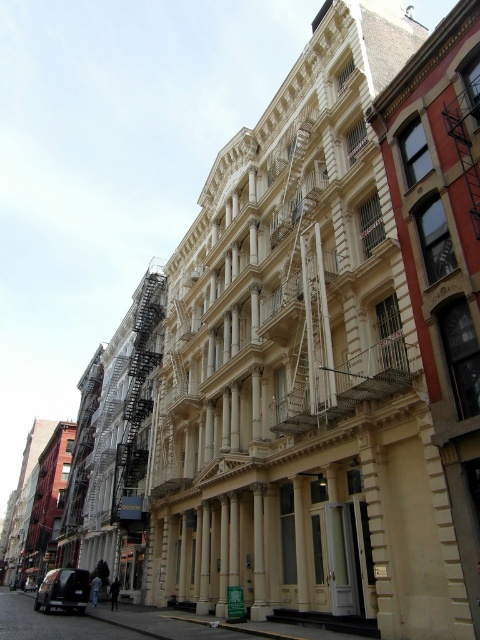
Question: Which of the following is the closest to the observer?

Choices:
 (A) (60, 593)
 (B) (144, 368)

Answer: (A)

Question: Which point is farther from the camera taking this photo?

Choices:
 (A) (145, 417)
 (B) (83, 593)

Answer: (A)

Question: Can you confirm if black metal fire escape at left is bigger than shiny black car at lower left?

Choices:
 (A) no
 (B) yes

Answer: (A)

Question: Considering the relative positions of black metal fire escape at left and shiny black car at lower left in the image provided, where is black metal fire escape at left located with respect to shiny black car at lower left?

Choices:
 (A) right
 (B) left

Answer: (A)

Question: Can you confirm if black metal fire escape at left is wider than shiny black car at lower left?

Choices:
 (A) no
 (B) yes

Answer: (A)